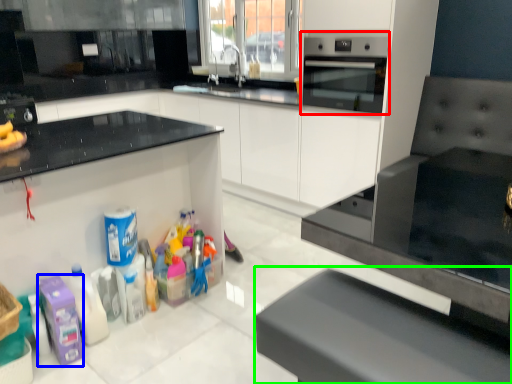
Question: Considering the real-world distances, which object is farthest from home appliance (highlighted by a red box)? cleaning product (highlighted by a blue box) or furniture (highlighted by a green box)?

Choices:
 (A) cleaning product
 (B) furniture

Answer: (A)